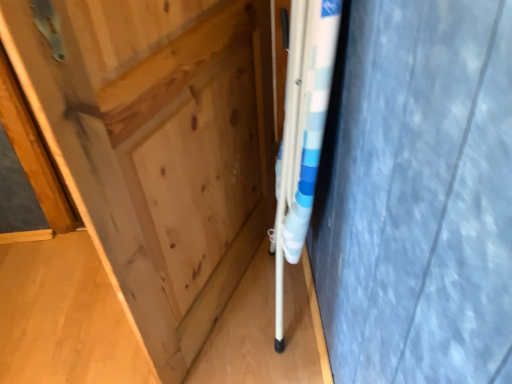
Find the location of a particular element. This screenshot has height=384, width=512. white plastic crutch at center is located at coordinates (302, 131).

Describe the element at coordinates (302, 131) in the screenshot. The height and width of the screenshot is (384, 512). I see `white plastic crutch at center` at that location.

Find the location of a particular element. The image size is (512, 384). white plastic crutch at center is located at coordinates (302, 131).